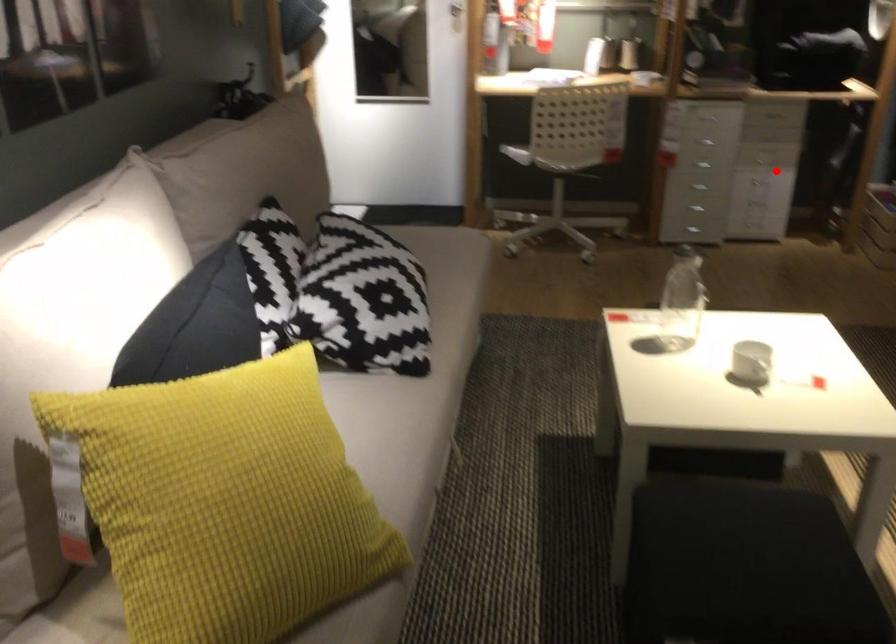
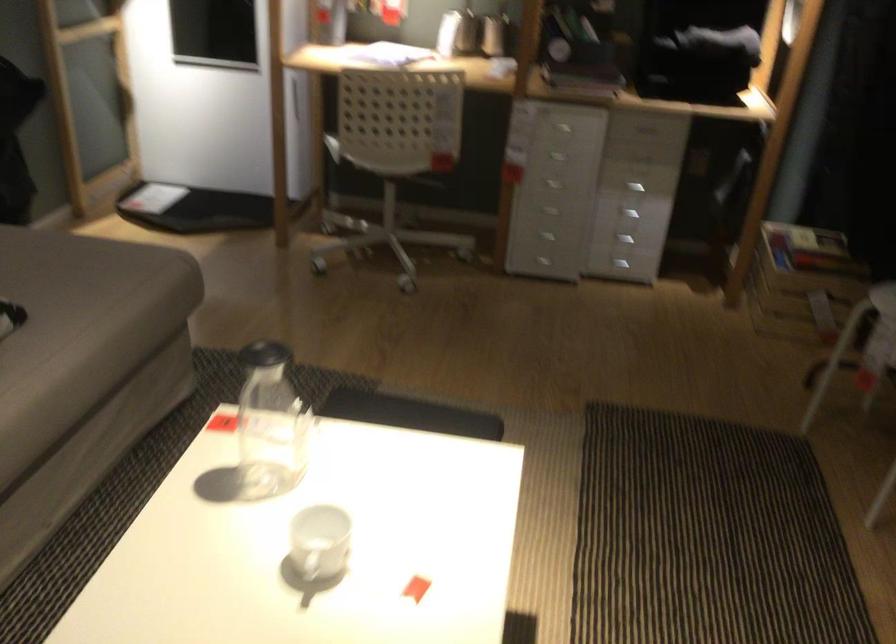
Question: I am providing you with two images of the same scene from different viewpoints. A red point is shown in image1. For the corresponding object point in image2, is it positioned nearer or farther from the camera?

Choices:
 (A) Nearer
 (B) Farther

Answer: (A)